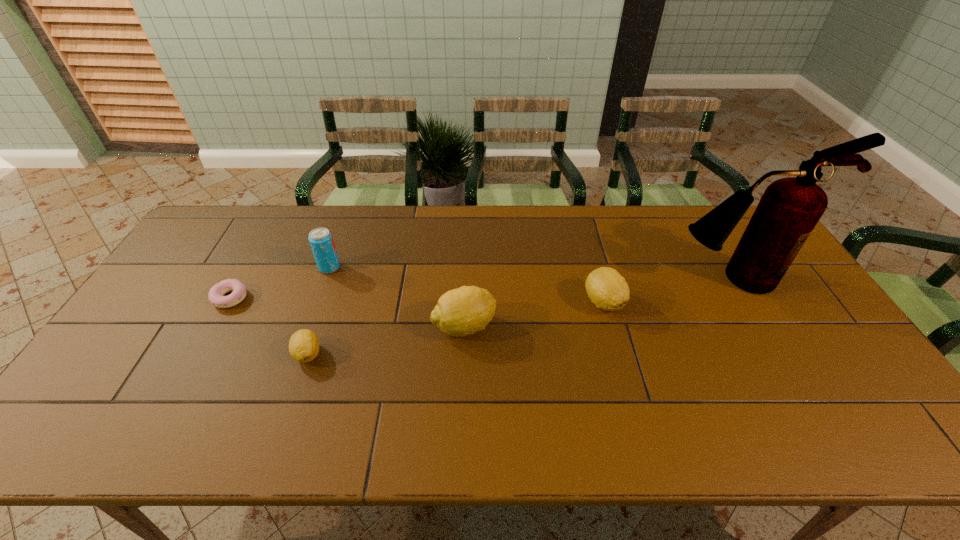
Please point a free position for a lemon on the right. Please provide its 2D coordinates. Your answer should be formatted as a tuple, i.e. [(x, y)], where the tuple contains the x and y coordinates of a point satisfying the conditions above.

[(730, 279)]